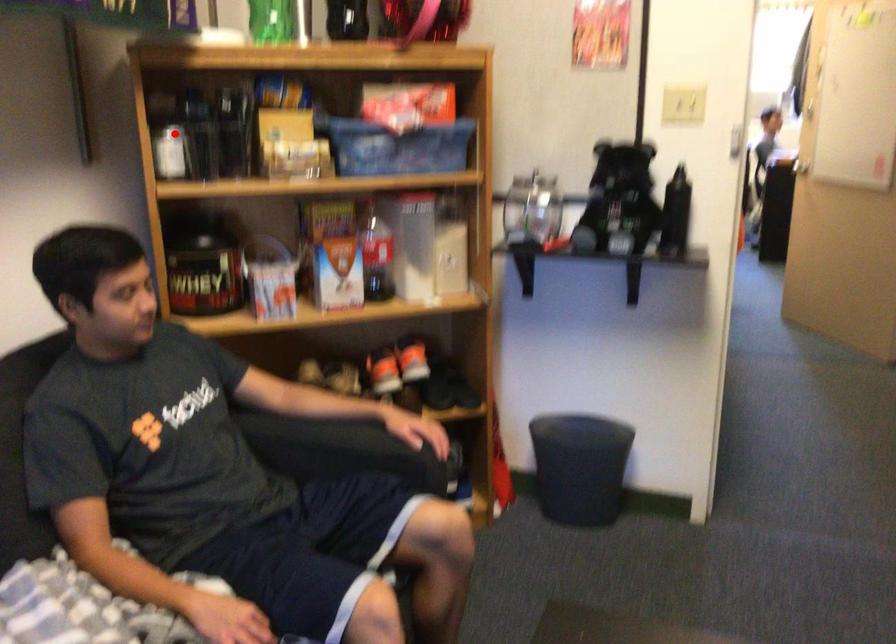
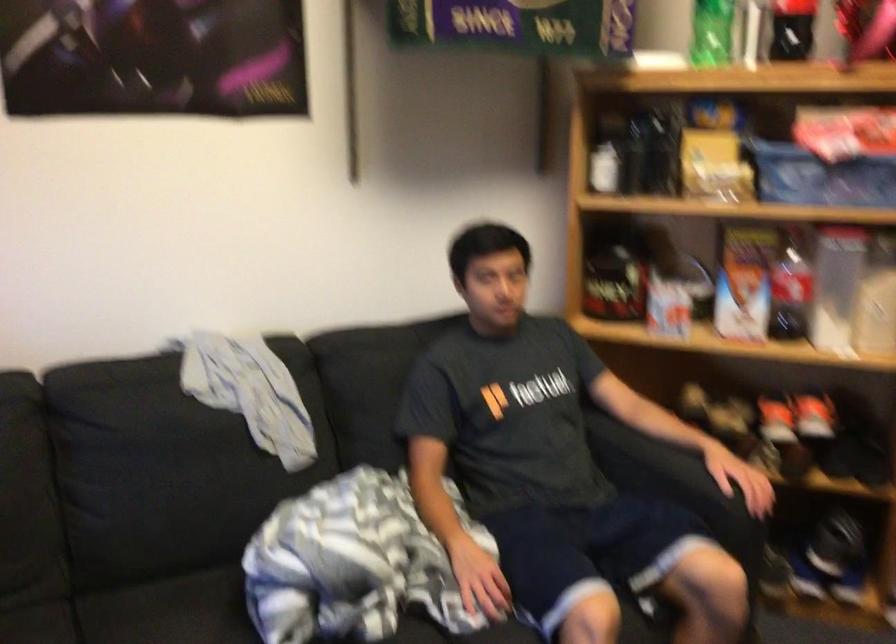
Question: A red point is marked in image1. In image2, is the corresponding 3D point closer to the camera or farther? Reply with the corresponding letter.

Choices:
 (A) The corresponding 3D point is closer.
 (B) The corresponding 3D point is farther.

Answer: (B)